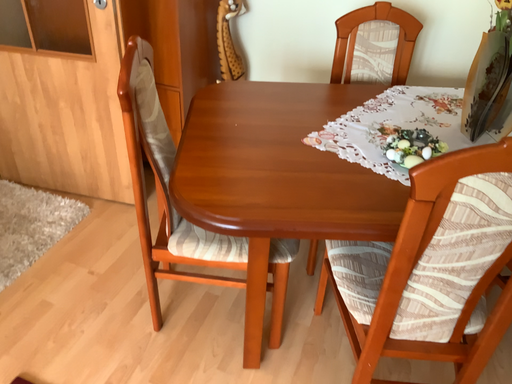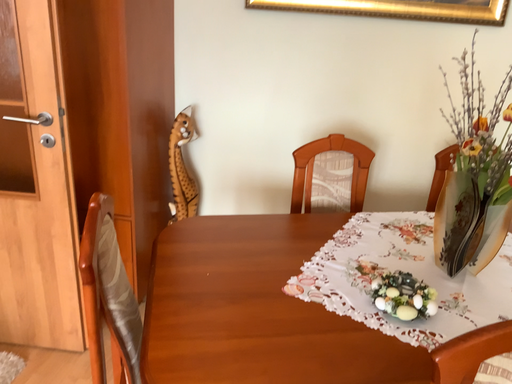
Question: Which way did the camera rotate in the video?

Choices:
 (A) rotated downward
 (B) rotated upward

Answer: (B)